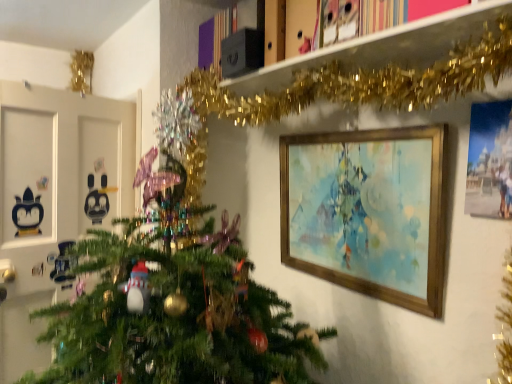
Question: From the image's perspective, is gold tinsel garland at upper center located beneath matte blue painting at upper right, positioned as the 1th picture frame in front-to-back order?

Choices:
 (A) no
 (B) yes

Answer: (A)

Question: From a real-world perspective, is gold tinsel garland at upper center physically above matte blue painting at upper right, acting as the 1th picture frame starting from the right?

Choices:
 (A) yes
 (B) no

Answer: (A)

Question: From a real-world perspective, is gold tinsel garland at upper center beneath matte blue painting at upper right, positioned as the 1th picture frame in front-to-back order?

Choices:
 (A) no
 (B) yes

Answer: (A)

Question: Is gold tinsel garland at upper center touching matte blue painting at upper right, positioned as the 1th picture frame in front-to-back order?

Choices:
 (A) no
 (B) yes

Answer: (A)

Question: Can you confirm if gold tinsel garland at upper center is positioned to the left of matte blue painting at upper right, positioned as the 1th picture frame in front-to-back order?

Choices:
 (A) yes
 (B) no

Answer: (A)

Question: Is gold tinsel garland at upper center shorter than matte blue painting at upper right, positioned as the 1th picture frame in front-to-back order?

Choices:
 (A) no
 (B) yes

Answer: (B)

Question: Is the position of wooden picture frame at upper right, marked as the second picture frame in a right-to-left arrangement, more distant than that of matte blue painting at upper right, acting as the 1th picture frame starting from the right?

Choices:
 (A) no
 (B) yes

Answer: (B)

Question: From the image's perspective, is wooden picture frame at upper right, the second picture frame when ordered from front to back, beneath matte blue painting at upper right, which appears as the second picture frame when viewed from the back?

Choices:
 (A) no
 (B) yes

Answer: (B)

Question: Is wooden picture frame at upper right, the second picture frame when ordered from front to back, not inside matte blue painting at upper right, positioned as the 1th picture frame in front-to-back order?

Choices:
 (A) yes
 (B) no

Answer: (A)

Question: Does wooden picture frame at upper right, arranged as the first picture frame when viewed from the back, have a greater height compared to matte blue painting at upper right, acting as the 1th picture frame starting from the right?

Choices:
 (A) no
 (B) yes

Answer: (B)

Question: Is wooden picture frame at upper right, which is the first picture frame from left to right, closer to the viewer compared to matte blue painting at upper right, acting as the 1th picture frame starting from the right?

Choices:
 (A) yes
 (B) no

Answer: (B)

Question: Is wooden picture frame at upper right, which is the first picture frame from left to right, to the left of matte blue painting at upper right, positioned as the 1th picture frame in front-to-back order, from the viewer's perspective?

Choices:
 (A) no
 (B) yes

Answer: (B)

Question: Does gold tinsel garland at upper center touch wooden picture frame at upper right, which is the first picture frame from left to right?

Choices:
 (A) no
 (B) yes

Answer: (A)